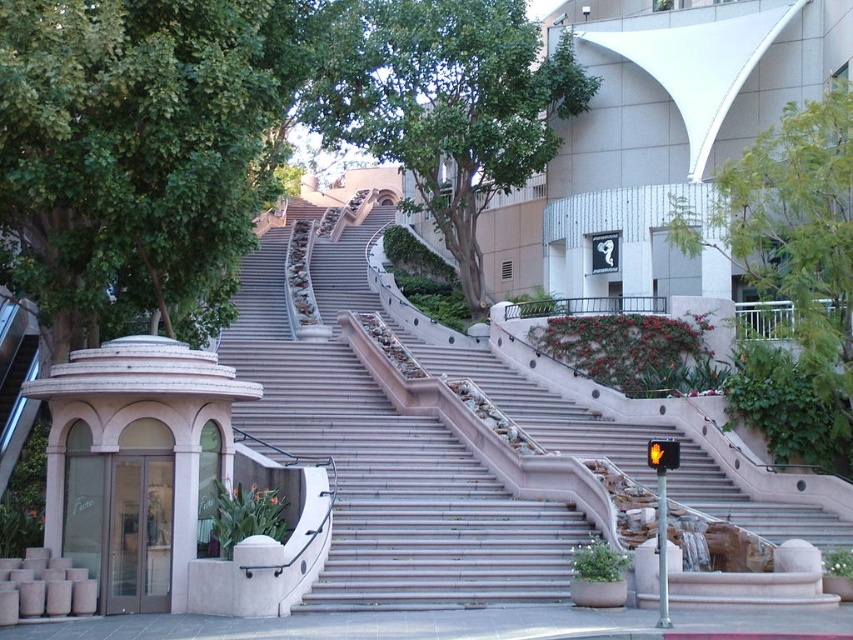
Question: Which of the following is the closest to the observer?

Choices:
 (A) (463, 208)
 (B) (465, 492)
 (C) (264, 154)

Answer: (B)

Question: Does green leafy tree at left appear on the left side of green leafy tree at center?

Choices:
 (A) yes
 (B) no

Answer: (A)

Question: Can you confirm if green leafy tree at left is positioned above green leafy tree at center?

Choices:
 (A) yes
 (B) no

Answer: (B)

Question: Is green leafy tree at left bigger than green leafy tree at center?

Choices:
 (A) no
 (B) yes

Answer: (A)

Question: Which point appears closest to the camera in this image?

Choices:
 (A) (402, 596)
 (B) (247, 200)

Answer: (A)

Question: Among these objects, which one is nearest to the camera?

Choices:
 (A) green leafy tree at upper center
 (B) green leafy tree at left
 (C) green leafy tree at center

Answer: (B)